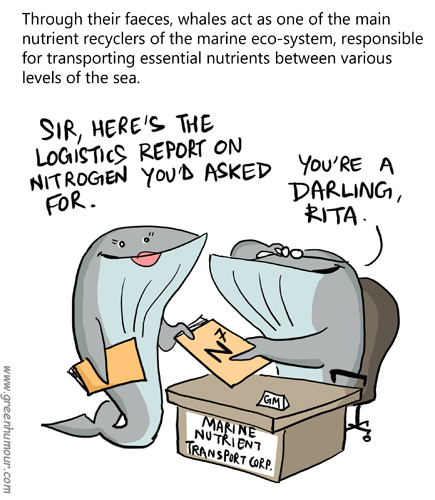
In order to click on desk corners in this screenshot , I will do `click(275, 418)`, `click(168, 389)`, `click(359, 390)`.